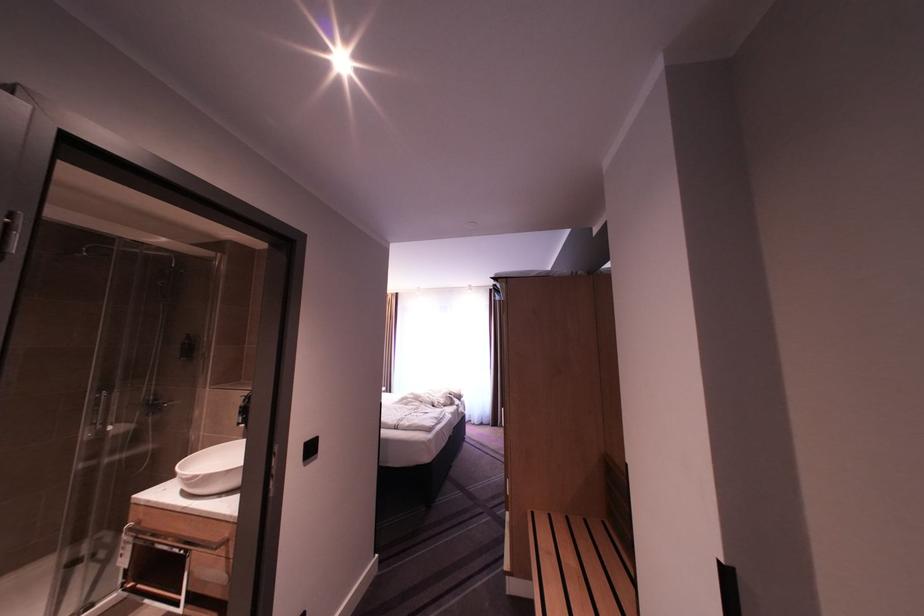
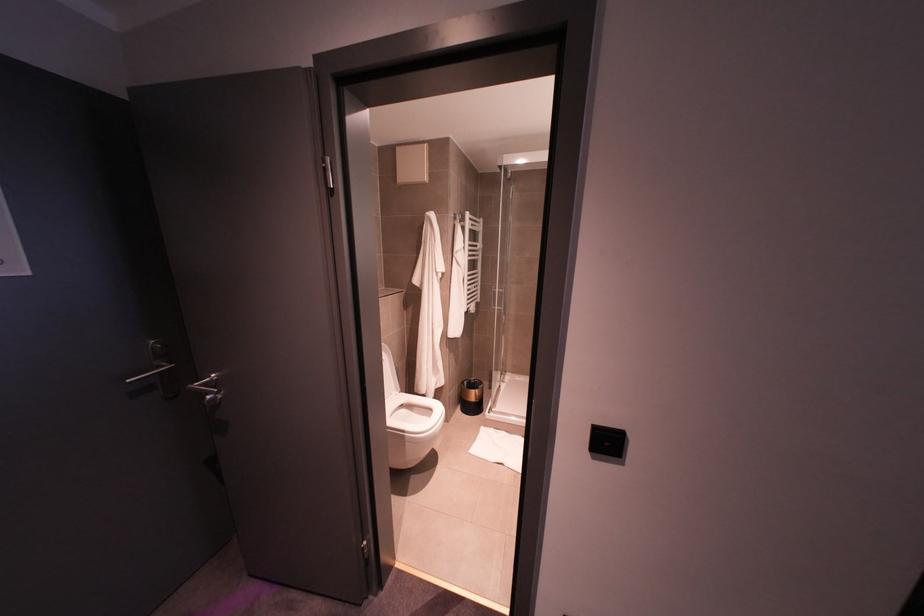
Question: Based on the continuous images, in which direction is the camera rotating? Reply with the corresponding letter.

Choices:
 (A) Left
 (B) Right
 (C) Up
 (D) Down

Answer: (A)